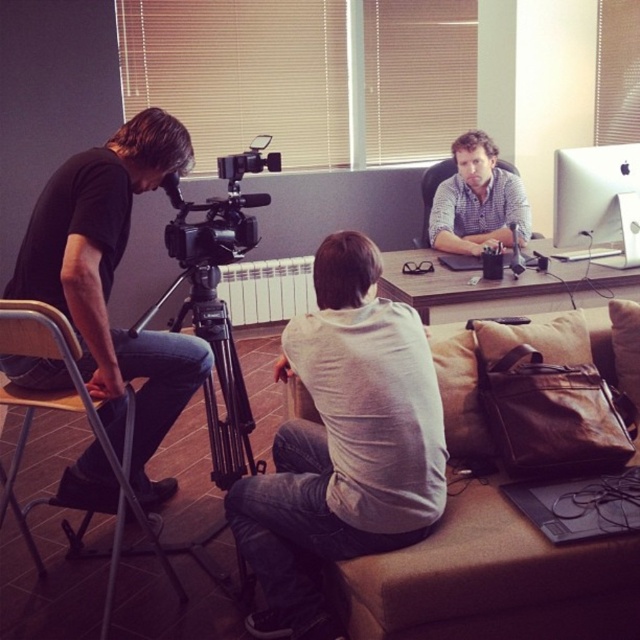
Is point (88, 202) behind point (218, 410)?

No.

Who is higher up, black matte camera at left or black metal tripod at left?

black matte camera at left

This screenshot has width=640, height=640. Identify the location of black matte camera at left. (112, 282).

The image size is (640, 640). What do you see at coordinates (342, 444) in the screenshot?
I see `white cotton shirt at center` at bounding box center [342, 444].

Is white cotton shirt at center wider than brown fabric couch at lower right?

In fact, white cotton shirt at center might be narrower than brown fabric couch at lower right.

Between point (304, 465) and point (502, 540), which one is positioned in front?

Point (502, 540) is more forward.

The height and width of the screenshot is (640, 640). Identify the location of white cotton shirt at center. (342, 444).

Is white cotton shirt at center bigger than wooden desk at center?

No, white cotton shirt at center is not bigger than wooden desk at center.

Which is above, white cotton shirt at center or wooden desk at center?

wooden desk at center

You are a GUI agent. You are given a task and a screenshot of the screen. Output one action in this format:
    pyautogui.click(x=<x>, y=<y>)
    Task: Click on the white cotton shirt at center
    The image size is (640, 640).
    Given the screenshot: What is the action you would take?
    pyautogui.click(x=342, y=444)